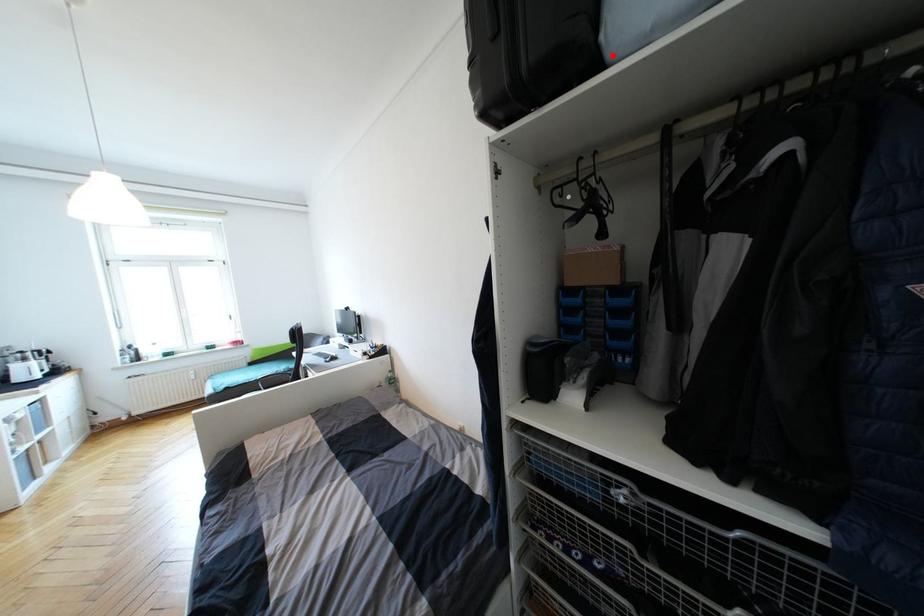
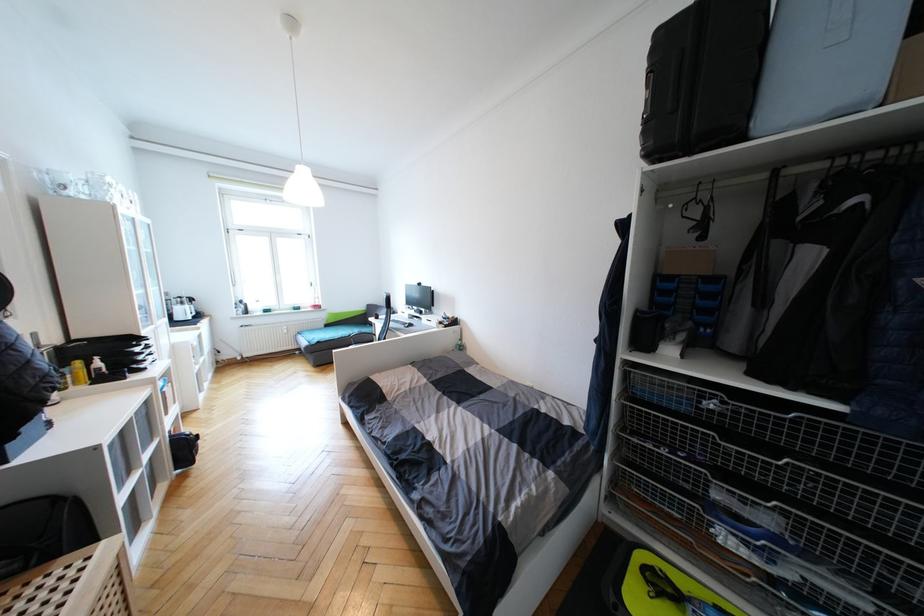
Locate, in the second image, the point that corresponds to the highlighted location in the first image.

(757, 134)